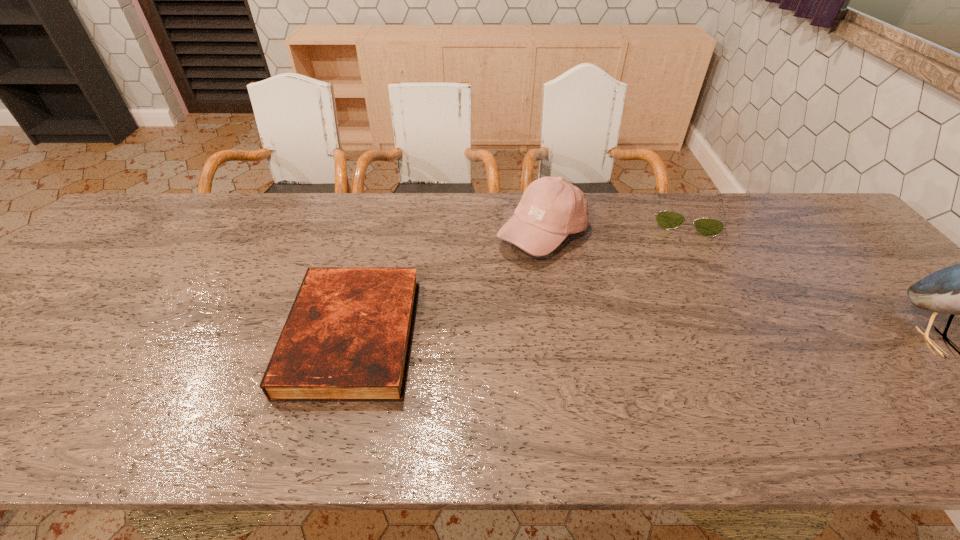
Image resolution: width=960 pixels, height=540 pixels. I want to click on vacant region located 0.260m on the front-facing side of the third object from left to right, so click(x=684, y=299).

What are the coordinates of `free space located on the front-facing side of the third object from left to right` in the screenshot? It's located at (684, 258).

The width and height of the screenshot is (960, 540). Identify the location of vacant space positioned on the front-facing side of the third object from left to right. (684, 260).

What are the coordinates of `baseball cap at the far edge` in the screenshot? It's located at (551, 208).

What are the coordinates of `sunglasses that is at the far edge` in the screenshot? It's located at (708, 227).

This screenshot has width=960, height=540. Find the location of `object present at the near edge`. object present at the near edge is located at coordinates (347, 338).

In the image, there is a desktop. Identify the location of vacant region at the far edge. (248, 219).

The width and height of the screenshot is (960, 540). Find the location of `blank space at the near edge of the desktop`. blank space at the near edge of the desktop is located at coordinates (255, 403).

Identify the location of vacant space at the left edge. This screenshot has height=540, width=960. (56, 328).

Find the location of a particular element. The image size is (960, 540). free space at the right edge is located at coordinates (899, 288).